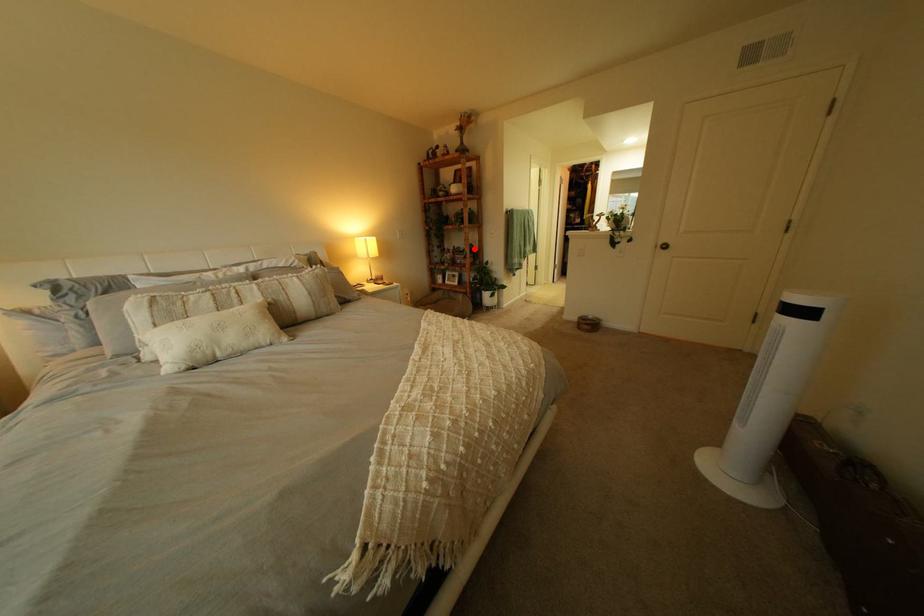
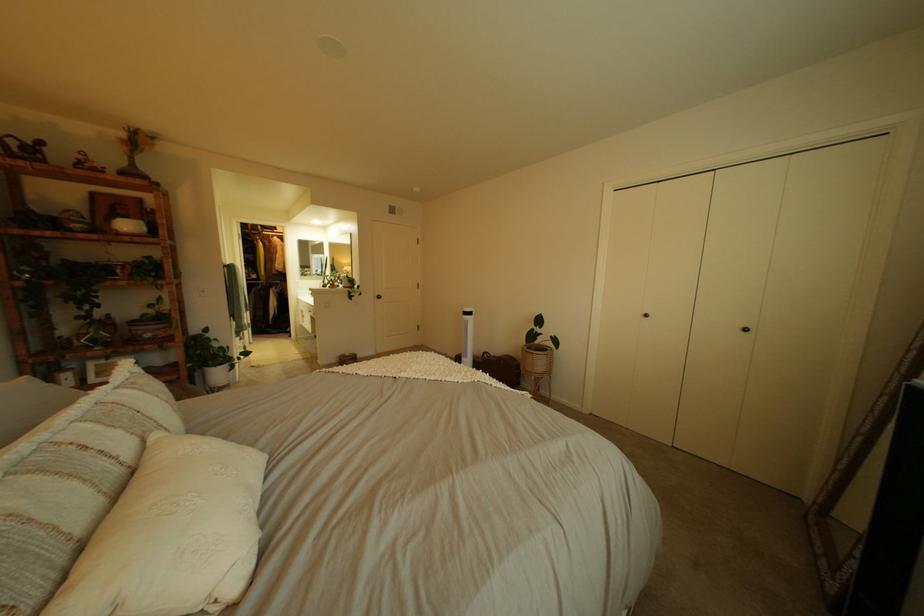
In the second image, find the point that corresponds to the highlighted location in the first image.

(161, 315)